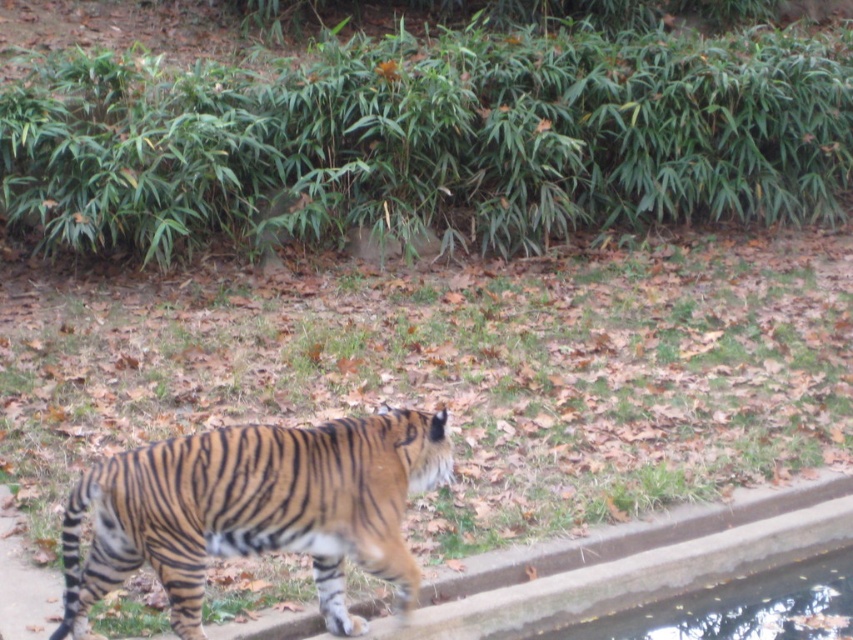
Between orange-brown striped tiger at center and clear concrete edge at lower right, which one has less height?

With less height is clear concrete edge at lower right.

Looking at this image, between orange-brown striped tiger at center and clear concrete edge at lower right, which one appears on the right side from the viewer's perspective?

clear concrete edge at lower right

Find the location of a particular element. The height and width of the screenshot is (640, 853). orange-brown striped tiger at center is located at coordinates (254, 509).

Identify the location of orange-brown striped tiger at center. (254, 509).